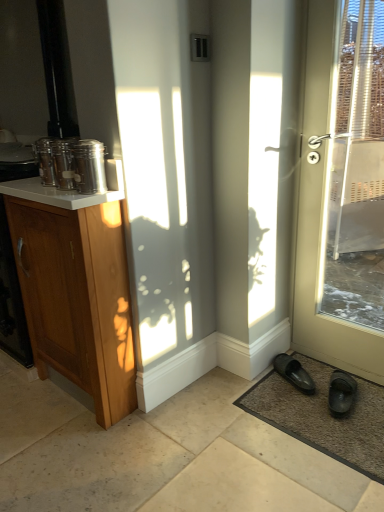
Where is `free space on the front side of black rubber slippers at lower right, which appears as the 1th footwear when viewed from the right`? free space on the front side of black rubber slippers at lower right, which appears as the 1th footwear when viewed from the right is located at coordinates (351, 432).